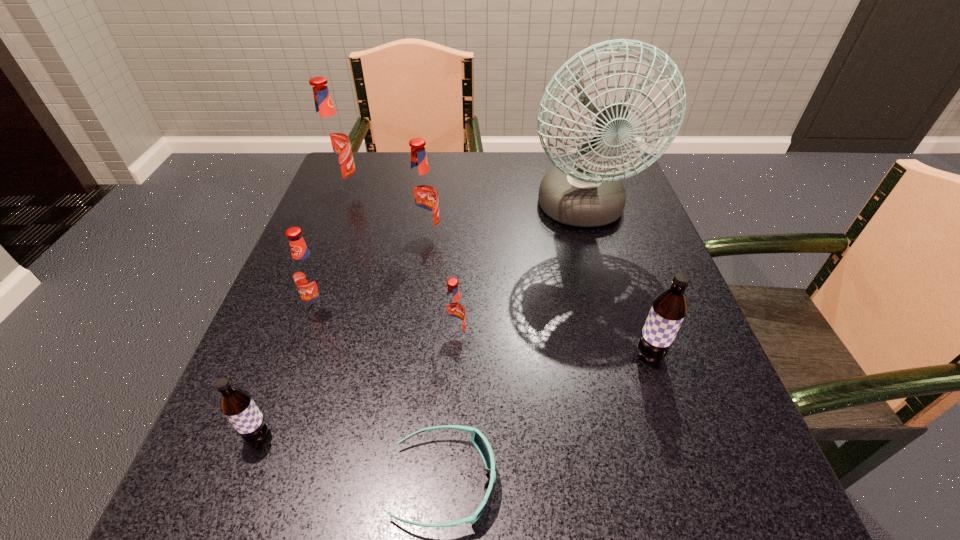
Image resolution: width=960 pixels, height=540 pixels. What are the coordinates of `red root beer that is the nearest to the farthest root beer` in the screenshot? It's located at (422, 194).

I want to click on red root beer identified as the closest to the third red root beer from left to right, so click(332, 141).

In order to click on free space that satisfies the following two spatial constraints: 1. in front of the tallest object where the airflow is directed; 2. on the front-facing side of the sunglasses in this screenshot , I will do `click(658, 481)`.